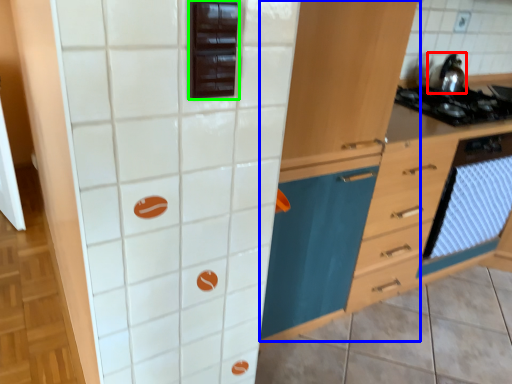
Question: Based on their relative distances, which object is nearer to kitchen appliance (highlighted by a red box)? Choose from cabinetry (highlighted by a blue box) and appliance (highlighted by a green box).

Choices:
 (A) cabinetry
 (B) appliance

Answer: (A)